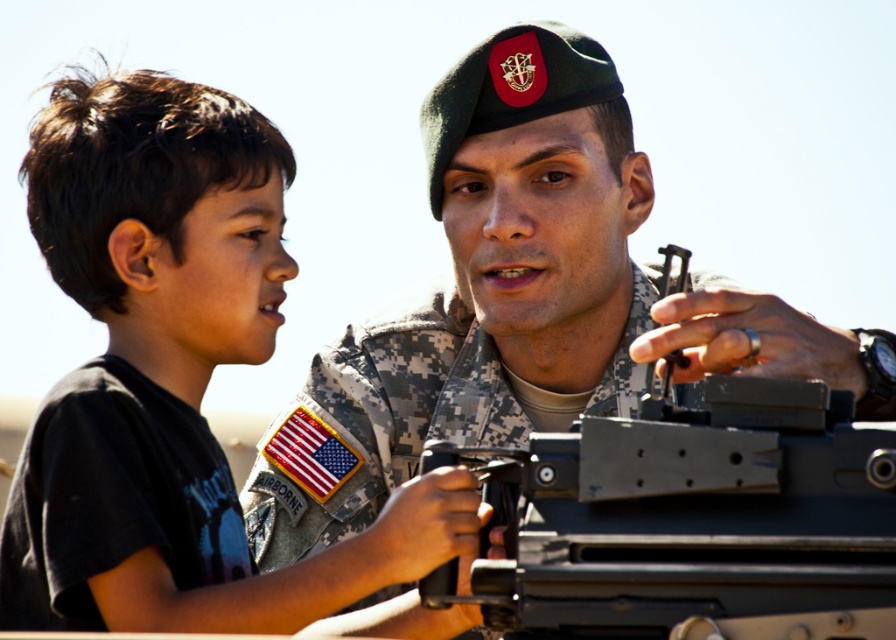
Where is the black matte shirt at left located in the image?

The black matte shirt at left is located at point (173,378).